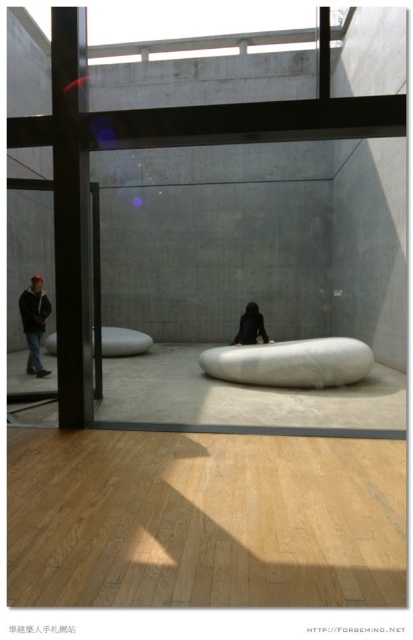
Question: Which of the following is the closest to the observer?

Choices:
 (A) dark brown leather jacket at center
 (B) dark gray hoodie at left

Answer: (B)

Question: Can you confirm if black metal/texture pillar at left is wider than dark brown leather jacket at center?

Choices:
 (A) yes
 (B) no

Answer: (B)

Question: Does dark gray hoodie at left lie behind dark brown leather jacket at center?

Choices:
 (A) yes
 (B) no

Answer: (B)

Question: Is dark gray hoodie at left thinner than dark brown leather jacket at center?

Choices:
 (A) yes
 (B) no

Answer: (B)

Question: Which point is closer to the camera?

Choices:
 (A) (33, 369)
 (B) (71, 339)

Answer: (B)

Question: Which point is closer to the camera?

Choices:
 (A) (258, 314)
 (B) (35, 300)

Answer: (B)